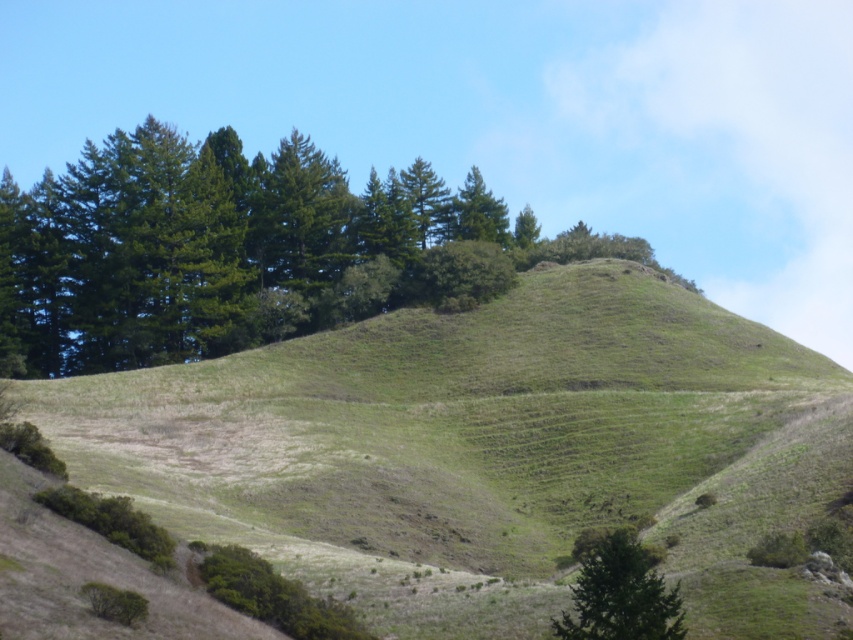
Question: Can you confirm if green leafy trees at upper center is positioned below green matte tree at lower right?

Choices:
 (A) yes
 (B) no

Answer: (B)

Question: Can you confirm if green grassy hillside at center is positioned below green matte tree at lower right?

Choices:
 (A) yes
 (B) no

Answer: (B)

Question: Does green leafy trees at upper center have a lesser width compared to green matte tree at lower right?

Choices:
 (A) no
 (B) yes

Answer: (A)

Question: Which object is closer to the camera taking this photo?

Choices:
 (A) green grassy hillside at center
 (B) green matte tree at lower right
 (C) green leafy trees at upper center

Answer: (B)

Question: Which object is closer to the camera taking this photo?

Choices:
 (A) green grassy hillside at center
 (B) green leafy trees at upper center

Answer: (A)

Question: Which of the following is the closest to the observer?

Choices:
 (A) (210, 253)
 (B) (633, 563)

Answer: (B)